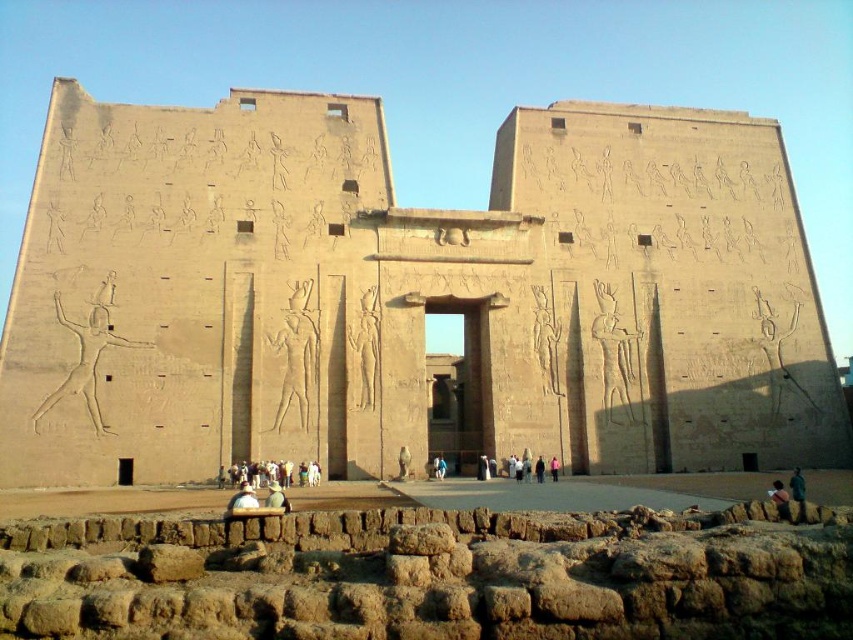
Question: Does brown stone door at center have a greater width compared to smooth beige figure at center-left?

Choices:
 (A) no
 (B) yes

Answer: (A)

Question: Among these points, which one is nearest to the camera?

Choices:
 (A) (469, 428)
 (B) (276, 493)
 (C) (550, 476)
 (D) (248, 472)

Answer: (B)

Question: Which point is closer to the camera?

Choices:
 (A) (624, 344)
 (B) (554, 477)

Answer: (B)

Question: Is sandstone temple at center below pink fabric person at center?

Choices:
 (A) no
 (B) yes

Answer: (A)

Question: Is sandstone temple at center smaller than smooth beige figure at center-left?

Choices:
 (A) yes
 (B) no

Answer: (B)

Question: Among these objects, which one is nearest to the camera?

Choices:
 (A) sandstone temple at center
 (B) brown stone door at center

Answer: (A)